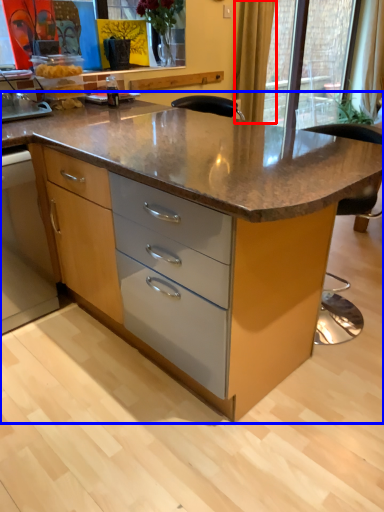
Question: Among these objects, which one is farthest to the camera, curtain (highlighted by a red box) or table (highlighted by a blue box)?

Choices:
 (A) curtain
 (B) table

Answer: (A)